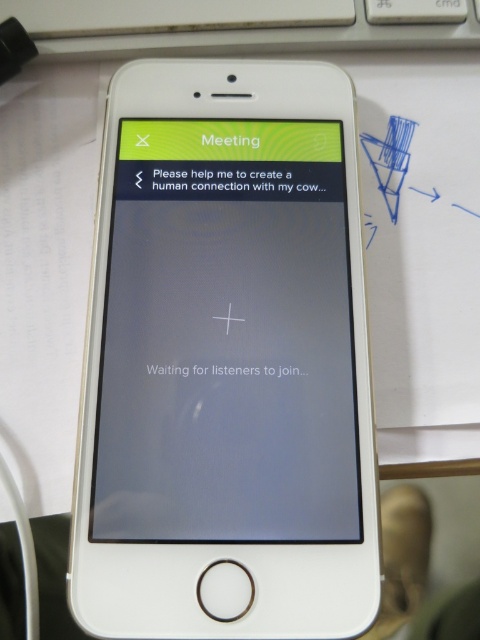
You are a person with normal vision trying to read the text on the matte glass screen at center. Considering the distance between you and the screen, would you be able to read the text clearly without moving closer?

The matte glass screen at center is 28.09 inches away from the viewer. At this distance, a person with normal vision should be able to read the text clearly without needing to move closer, as typical reading distance for smartphones is around 12 to 16 inches, but 28 inches is still within a comfortable range for most people to read text without strain.

You are a photographer taking a close up photo of the white smartphone screen. You notice two points on the screen at coordinates point (214,326) and point (128,17). Which point will appear larger in your photo?

Point (214,326) is closer to the camera than point (128,17), so it will appear larger in the photo.

You are holding a white smartphone with a matte glass screen at center and a white plastic keyboard at upper center. Which part of the phone is thinner?

The matte glass screen at center is thinner than the white plastic keyboard at upper center.